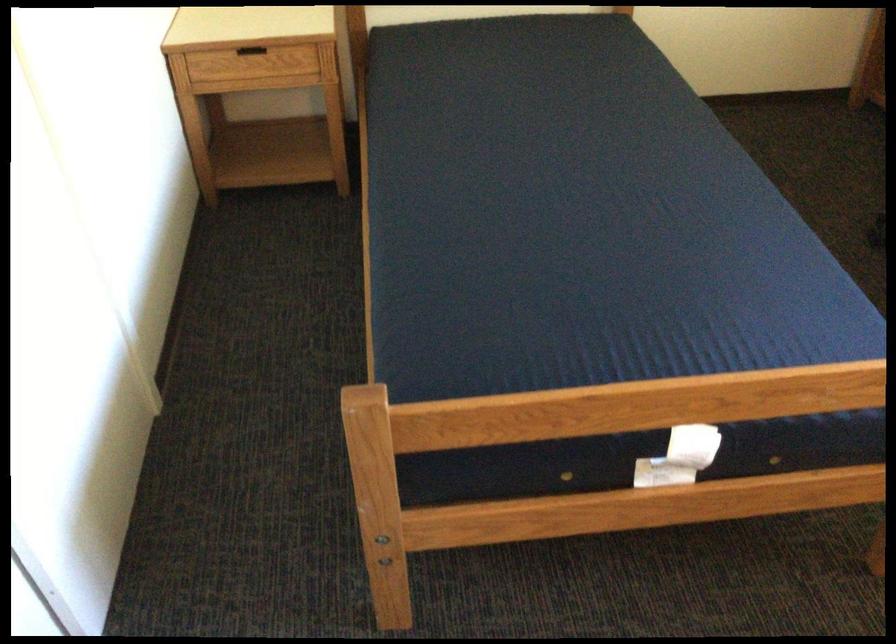
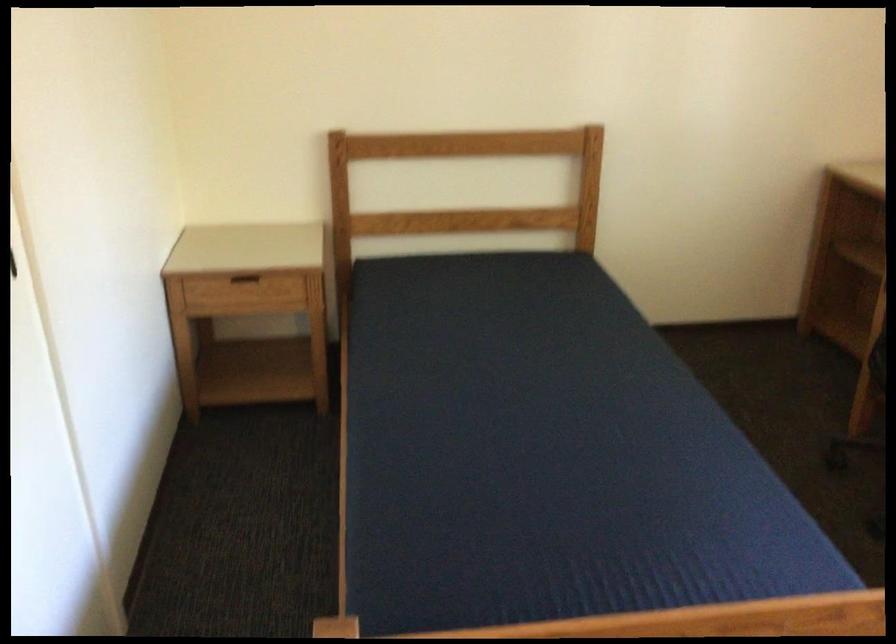
Question: Which direction would the cameraman need to move to produce the second image? Reply with the corresponding letter.

Choices:
 (A) Left
 (B) Right
 (C) Forward
 (D) Backward

Answer: (D)